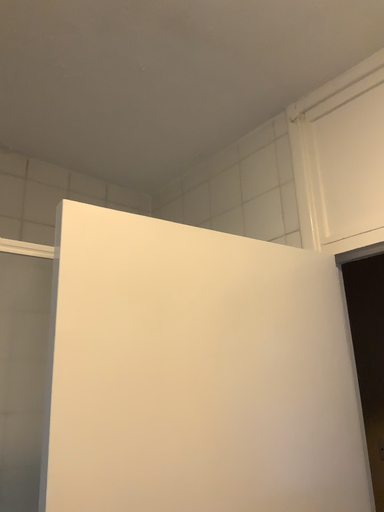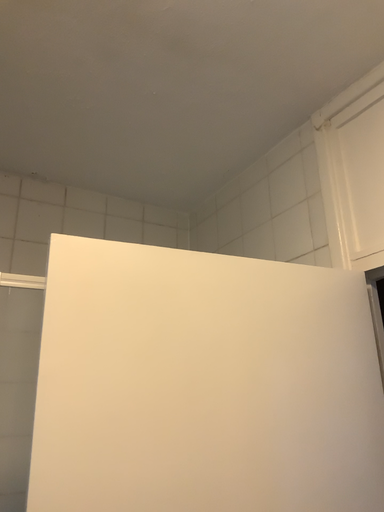
Question: How did the camera likely rotate when shooting the video?

Choices:
 (A) rotated right
 (B) rotated left

Answer: (B)